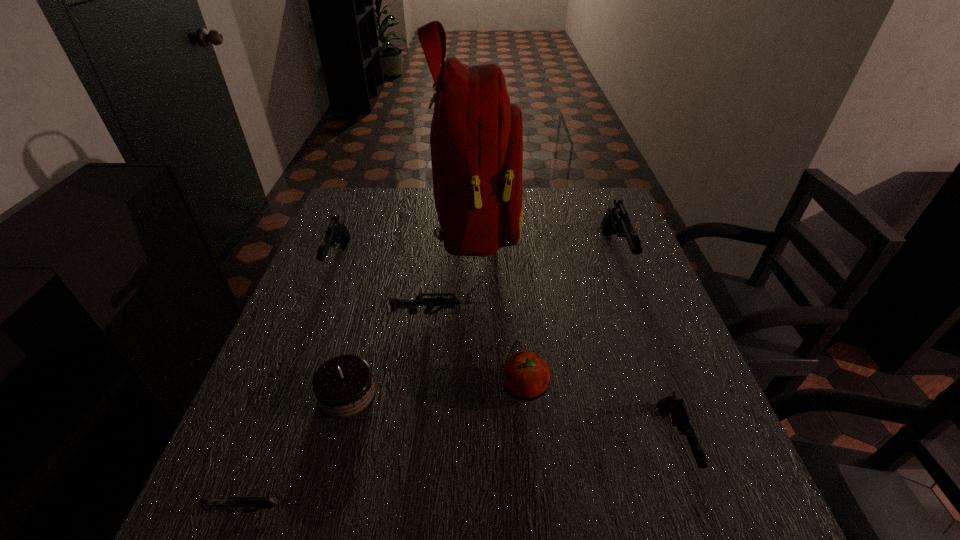
I want to click on pink backpack, so click(476, 138).

Identify the location of backpack. (476, 138).

The width and height of the screenshot is (960, 540). Find the location of `the biggest black gun`. the biggest black gun is located at coordinates (616, 221).

Locate an element on the screen. the tallest gun is located at coordinates (616, 221).

Where is `the leftmost black gun`? The image size is (960, 540). the leftmost black gun is located at coordinates (337, 233).

Where is `the second biggest black gun`? the second biggest black gun is located at coordinates (337, 233).

You are a GUI agent. You are given a task and a screenshot of the screen. Output one action in this format:
    pyautogui.click(x=<x>, y=<y>)
    Task: Click on the apple
    The height and width of the screenshot is (540, 960).
    Given the screenshot: What is the action you would take?
    pyautogui.click(x=525, y=376)

The width and height of the screenshot is (960, 540). What are the coordinates of `chocolate chocolate cake` in the screenshot? It's located at (344, 386).

What are the coordinates of `the nearest black gun` in the screenshot? It's located at (680, 417).

The image size is (960, 540). What are the coordinates of `the fourth farthest gun` in the screenshot? It's located at (680, 417).